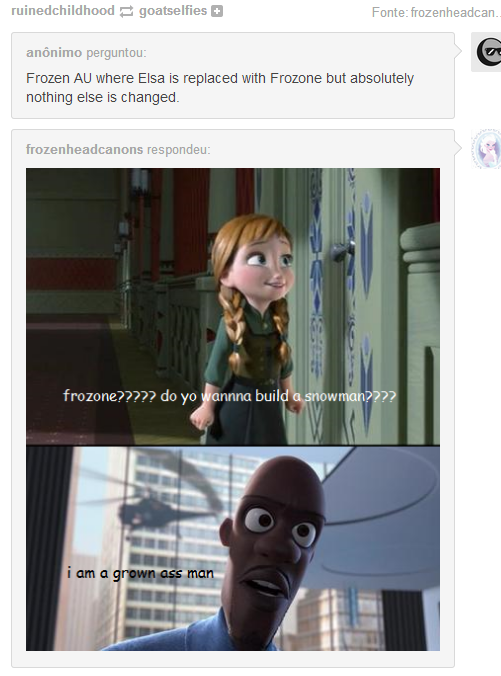
Where is `window`? window is located at coordinates (187, 547).